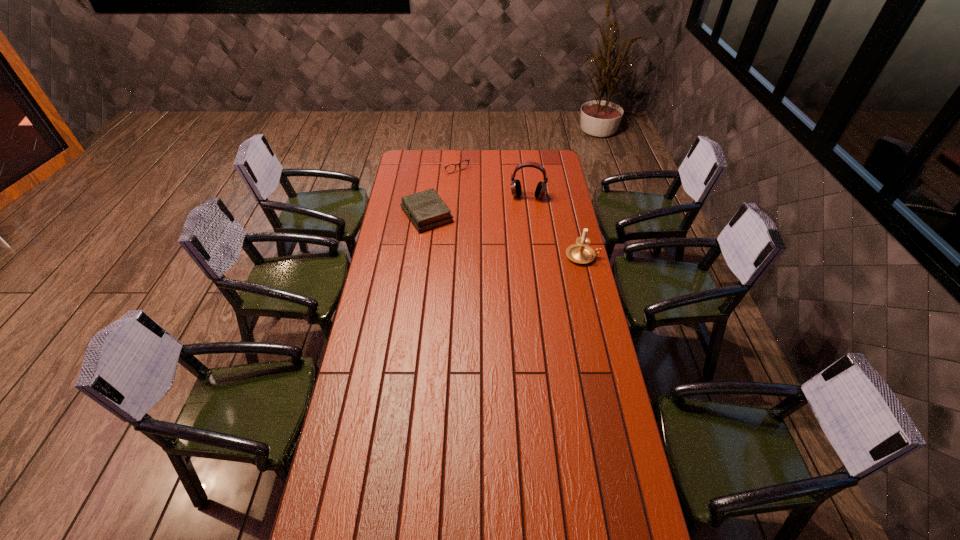
Find the location of a particular element. This screenshot has width=960, height=540. book is located at coordinates (426, 210).

The height and width of the screenshot is (540, 960). Find the location of `the nearest object`. the nearest object is located at coordinates (581, 253).

In order to click on the rightmost object in this screenshot , I will do `click(581, 253)`.

The image size is (960, 540). I want to click on the third object from left to right, so click(x=516, y=190).

I want to click on headset, so click(x=516, y=190).

Identify the location of the shortest object. (462, 165).

I want to click on the farthest object, so click(x=462, y=165).

Image resolution: width=960 pixels, height=540 pixels. What are the coordinates of `blank area located on the front of the book` in the screenshot? It's located at click(419, 274).

Locate an element on the screen. vacant point located 0.350m on the ear pads of the tallest object is located at coordinates (520, 247).

Find the location of a particular element. blank space located on the ear pads of the tallest object is located at coordinates (523, 223).